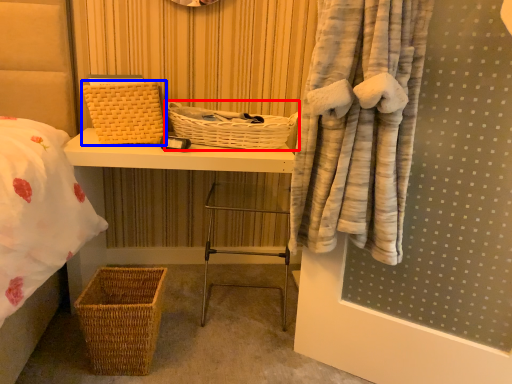
Question: Which object is further to the camera taking this photo, basket (highlighted by a red box) or basket (highlighted by a blue box)?

Choices:
 (A) basket
 (B) basket

Answer: (A)